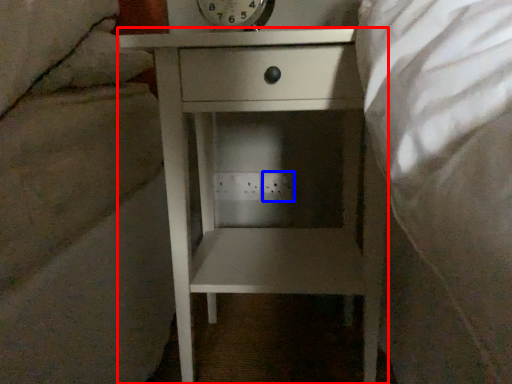
Question: Which object is closer to the camera taking this photo, nightstand (highlighted by a red box) or electric outlet (highlighted by a blue box)?

Choices:
 (A) nightstand
 (B) electric outlet

Answer: (A)